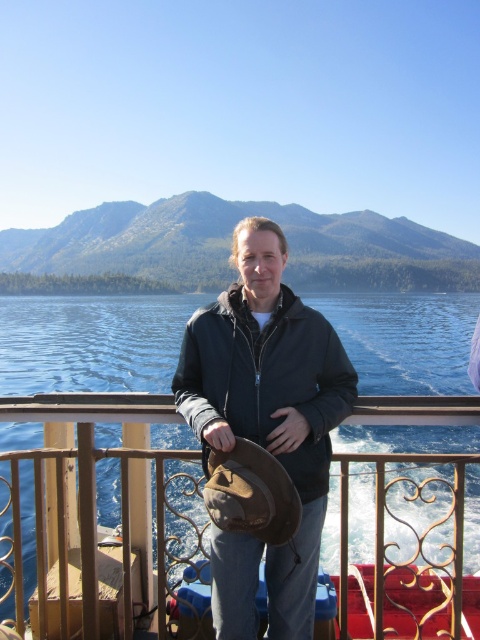
Question: Which object is farther from the camera taking this photo?

Choices:
 (A) brown leather hat at center
 (B) matte black jacket at center

Answer: (B)

Question: Can you confirm if brown leather hat at center is positioned above matte black jacket at center?

Choices:
 (A) no
 (B) yes

Answer: (A)

Question: Does brown leather hat at center have a smaller size compared to matte black jacket at center?

Choices:
 (A) no
 (B) yes

Answer: (A)

Question: Which of the following is the closest to the observer?

Choices:
 (A) (14, 580)
 (B) (312, 326)

Answer: (B)

Question: Is brown leather hat at center to the left of matte black jacket at center from the viewer's perspective?

Choices:
 (A) yes
 (B) no

Answer: (A)

Question: Which point is farther to the camera?

Choices:
 (A) (237, 545)
 (B) (54, 636)

Answer: (B)